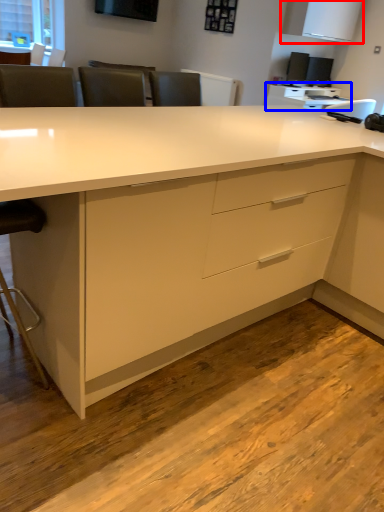
Question: Which object is closer to the camera taking this photo, cabinetry (highlighted by a red box) or computer desk (highlighted by a blue box)?

Choices:
 (A) cabinetry
 (B) computer desk

Answer: (A)